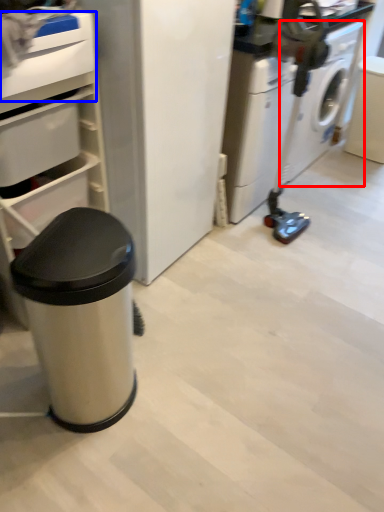
Question: Among these objects, which one is nearest to the camera, washing machine (highlighted by a red box) or drawer (highlighted by a blue box)?

Choices:
 (A) washing machine
 (B) drawer

Answer: (B)